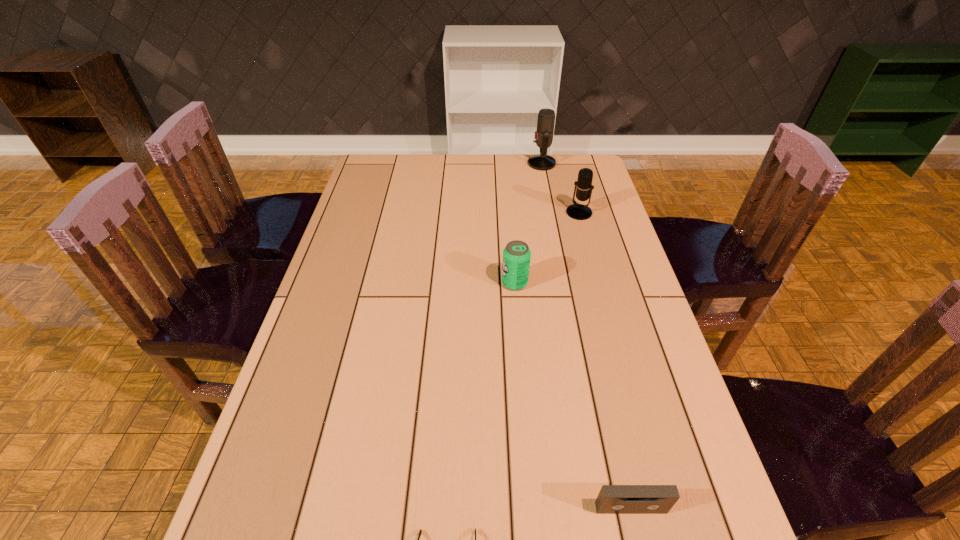
This screenshot has height=540, width=960. What are the coordinates of `the taller microphone` in the screenshot? It's located at (546, 117).

Where is `the farthest object`? Image resolution: width=960 pixels, height=540 pixels. the farthest object is located at coordinates (546, 117).

Find the location of a particular element. The height and width of the screenshot is (540, 960). the second tallest object is located at coordinates (584, 185).

The image size is (960, 540). In order to click on the fourth nearest object in this screenshot , I will do `click(584, 185)`.

This screenshot has width=960, height=540. I want to click on the third shortest object, so click(516, 255).

Identify the location of the second object from left to right. This screenshot has width=960, height=540. (516, 255).

Locate an element on the screen. The height and width of the screenshot is (540, 960). the second shortest object is located at coordinates (612, 499).

At what (x,y) coordinates should I click in order to perform the action: click on the fourth farthest object. Please return your answer as a coordinate pair (x, y). The image size is (960, 540). Looking at the image, I should click on (612, 499).

Locate an element on the screen. Image resolution: width=960 pixels, height=540 pixels. vacant space situated 0.320m on the side of the tallest object with the red ring is located at coordinates (446, 164).

The height and width of the screenshot is (540, 960). Identify the location of free space located on the side of the tallest object with the red ring. (482, 164).